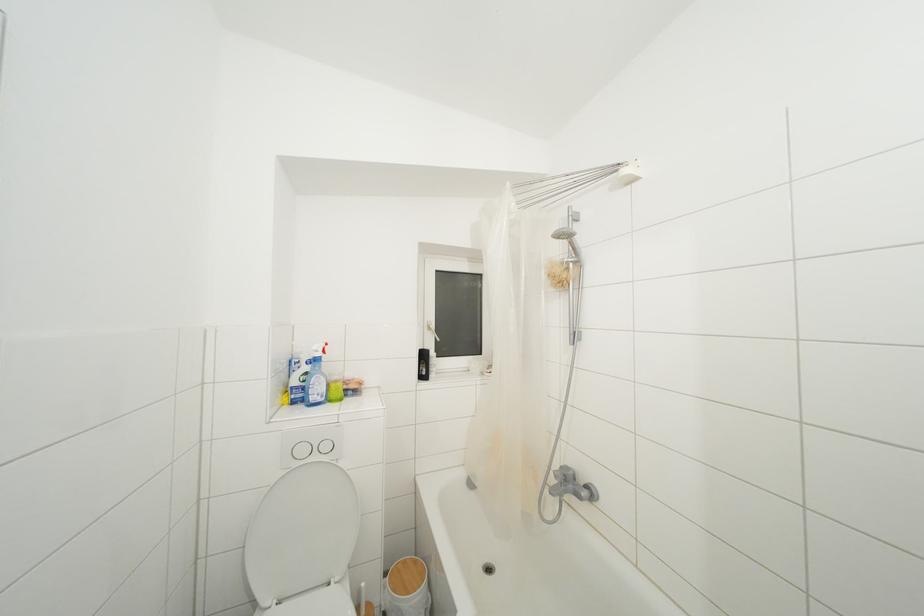
Find where to pull the white window handle. Please return your answer as a coordinate pair (x, y).

(432, 331)